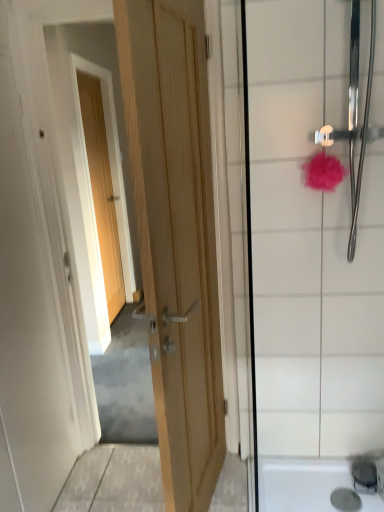
Locate an element on the screen. This screenshot has width=384, height=512. vacant space situated on the left part of satin nickel faucet at lower right is located at coordinates (319, 479).